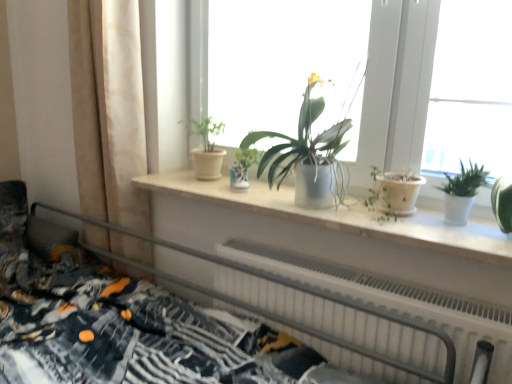
Question: Can you confirm if white matte window sill at center is shorter than matte silver pot at center, which is the second houseplant in right-to-left order?

Choices:
 (A) yes
 (B) no

Answer: (A)

Question: Is matte silver pot at center, which is the second houseplant in right-to-left order, at the back of white matte window sill at center?

Choices:
 (A) yes
 (B) no

Answer: (B)

Question: Is white matte window sill at center facing towards matte silver pot at center, which is the second houseplant in right-to-left order?

Choices:
 (A) no
 (B) yes

Answer: (A)

Question: Considering the relative sizes of white matte window sill at center and matte silver pot at center, which is the second houseplant in right-to-left order, in the image provided, is white matte window sill at center taller than matte silver pot at center, which is the second houseplant in right-to-left order,?

Choices:
 (A) yes
 (B) no

Answer: (B)

Question: Can you confirm if white matte window sill at center is wider than matte silver pot at center, which is the second houseplant in right-to-left order?

Choices:
 (A) no
 (B) yes

Answer: (B)

Question: Is white matte window sill at center in front of or behind matte white pot at center, marked as the 3th houseplant in a right-to-left arrangement, in the image?

Choices:
 (A) front
 (B) behind

Answer: (A)

Question: Is white matte window sill at center bigger or smaller than matte white pot at center, the 1th houseplant from the left?

Choices:
 (A) small
 (B) big

Answer: (B)

Question: From the image's perspective, is white matte window sill at center located above or below matte white pot at center, the 1th houseplant from the left?

Choices:
 (A) below
 (B) above

Answer: (A)

Question: Does point pos(442,240) appear closer or farther from the camera than point pos(215,165)?

Choices:
 (A) closer
 (B) farther

Answer: (A)

Question: Is matte silver pot at center, the second houseplant viewed from the left, taller or shorter than matte white windowsill at center?

Choices:
 (A) short
 (B) tall

Answer: (A)

Question: Considering the relative positions of matte silver pot at center, the second houseplant viewed from the left, and matte white windowsill at center in the image provided, is matte silver pot at center, the second houseplant viewed from the left, to the left or to the right of matte white windowsill at center?

Choices:
 (A) right
 (B) left

Answer: (B)

Question: Does point (303, 182) appear closer or farther from the camera than point (387, 84)?

Choices:
 (A) closer
 (B) farther

Answer: (A)

Question: Is matte silver pot at center, which is the second houseplant in right-to-left order, spatially inside matte white windowsill at center, or outside of it?

Choices:
 (A) inside
 (B) outside

Answer: (B)

Question: Visually, is patterned fabric bed at lower left positioned to the left or to the right of white glossy pot at right, which is the 3th houseplant in left-to-right order?

Choices:
 (A) right
 (B) left

Answer: (B)

Question: Considering the positions of patterned fabric bed at lower left and white glossy pot at right, which is the 1th houseplant in right-to-left order, in the image, is patterned fabric bed at lower left taller or shorter than white glossy pot at right, which is the 1th houseplant in right-to-left order,?

Choices:
 (A) short
 (B) tall

Answer: (B)